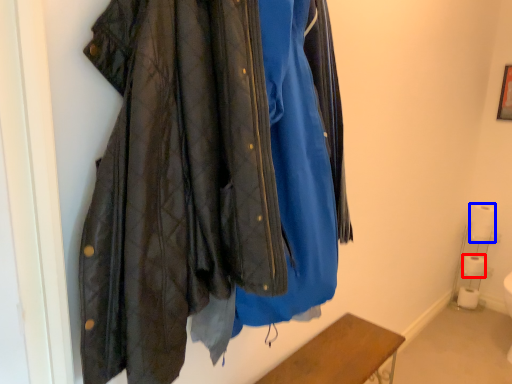
Question: Which object appears farthest to the camera in this image, toilet paper (highlighted by a red box) or toilet paper (highlighted by a blue box)?

Choices:
 (A) toilet paper
 (B) toilet paper

Answer: (A)